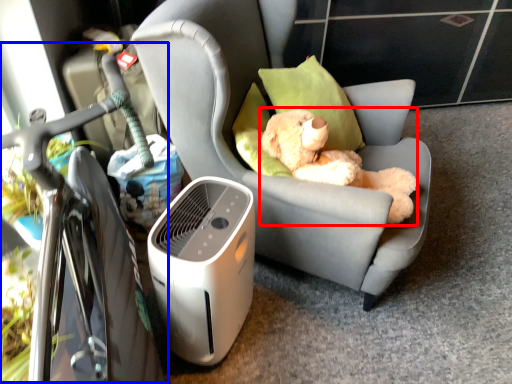
Question: Which of the following is the farthest to the observer, toy (highlighted by a red box) or bicycle (highlighted by a blue box)?

Choices:
 (A) toy
 (B) bicycle

Answer: (A)